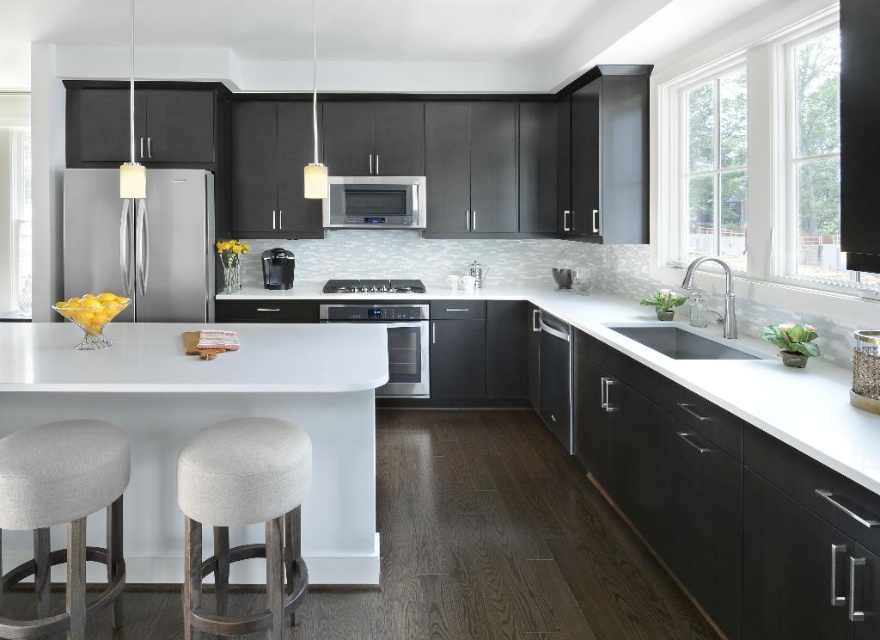
Who is taller, satin stainless steel refrigerator at left or satin black coffee maker at center?

satin stainless steel refrigerator at left

Between point (101, 230) and point (266, 268), which one is positioned in front?

Point (101, 230) is in front.

Is point (72, 177) in front of point (270, 276)?

That is True.

The width and height of the screenshot is (880, 640). In order to click on satin stainless steel refrigerator at left in this screenshot , I will do `click(176, 248)`.

Who is positioned more to the left, white glossy countertop at center or satin stainless steel dishwasher at center?

From the viewer's perspective, satin stainless steel dishwasher at center appears more on the left side.

I want to click on white glossy countertop at center, so (x=695, y=371).

Does satin stainless steel microwave at center come behind satin black coffee maker at center?

Yes, satin stainless steel microwave at center is further from the viewer.

Between point (390, 177) and point (274, 256), which one is positioned in front?

Point (274, 256) is in front.

Find the location of a particular element. satin stainless steel microwave at center is located at coordinates (374, 202).